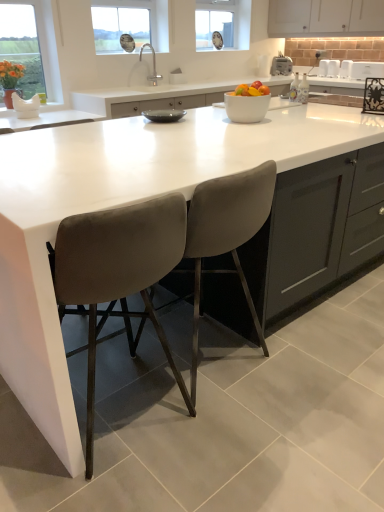
Find the location of a particular element. clear glass window at upper center is located at coordinates (120, 27).

Where is `white plastic toaster at upper center, which appears as the third appliance when viewed from the front`? Image resolution: width=384 pixels, height=512 pixels. white plastic toaster at upper center, which appears as the third appliance when viewed from the front is located at coordinates (281, 65).

Identify the location of clear glass clock at upper center, placed as the 2th window screen when sorted from left to right. The image size is (384, 512). (216, 23).

This screenshot has height=512, width=384. What do you see at coordinates (226, 233) in the screenshot?
I see `velvet grey chair at center, which is the 2th chair in left-to-right order` at bounding box center [226, 233].

The height and width of the screenshot is (512, 384). What do you see at coordinates (325, 18) in the screenshot?
I see `white matte cabinet at upper center` at bounding box center [325, 18].

The width and height of the screenshot is (384, 512). What are the coordinates of `white matte cabinet at upper center` in the screenshot? It's located at (325, 18).

Identify the location of chrome metallic faucet at upper center. (153, 65).

Is the surface of velvet grey chair at center, which is the 2th chair in left-to-right order, in direct contact with velvet grey bar stool at center, arranged as the second chair when viewed from the right?

velvet grey chair at center, which is the 2th chair in left-to-right order, is not next to velvet grey bar stool at center, arranged as the second chair when viewed from the right, and they're not touching.

Which point is more distant from viewer, (243, 228) or (160, 329)?

The point (160, 329) is more distant.

In the scene shown: How different are the orientations of velvet grey chair at center, which is the 2th chair in left-to-right order, and velvet grey bar stool at center, arranged as the second chair when viewed from the right, in degrees?

The facing directions of velvet grey chair at center, which is the 2th chair in left-to-right order, and velvet grey bar stool at center, arranged as the second chair when viewed from the right, are 8.98e-05 degrees apart.

Where is `chair behind the velvet grey bar stool at center, the 1th chair from the left`? chair behind the velvet grey bar stool at center, the 1th chair from the left is located at coordinates (226, 233).

Is chrome metallic faucet at upper center further to camera compared to white glossy microwave at upper right, the 1th appliance from the right?

No, chrome metallic faucet at upper center is closer to the camera.

Considering the points (141, 47) and (376, 66), which point is behind, point (141, 47) or point (376, 66)?

Point (376, 66)

Is chrome metallic faucet at upper center to the left of white glossy microwave at upper right, arranged as the 1th appliance when viewed from the front, from the viewer's perspective?

Yes, chrome metallic faucet at upper center is to the left of white glossy microwave at upper right, arranged as the 1th appliance when viewed from the front.

Are white glossy microwave at upper right, which is the third appliance in left-to-right order, and velvet grey bar stool at center, arranged as the second chair when viewed from the right, located far from each other?

white glossy microwave at upper right, which is the third appliance in left-to-right order, is far away from velvet grey bar stool at center, arranged as the second chair when viewed from the right.

Which object is wider, white glossy microwave at upper right, the 1th appliance from the right, or velvet grey bar stool at center, the 1th chair from the left?

velvet grey bar stool at center, the 1th chair from the left.

Does white glossy microwave at upper right, which is the third appliance in left-to-right order, have a lesser height compared to velvet grey bar stool at center, arranged as the second chair when viewed from the right?

Yes.

Which object is thinner, chrome metallic faucet at upper center or velvet grey bar stool at center, the 1th chair from the left?

chrome metallic faucet at upper center is thinner.

How many degrees apart are the facing directions of chrome metallic faucet at upper center and velvet grey bar stool at center, the 1th chair from the left?

The angle between the facing direction of chrome metallic faucet at upper center and the facing direction of velvet grey bar stool at center, the 1th chair from the left, is 176 degrees.

Looking at this image, is chrome metallic faucet at upper center at the right side of velvet grey bar stool at center, arranged as the second chair when viewed from the right?

In fact, chrome metallic faucet at upper center is to the left of velvet grey bar stool at center, arranged as the second chair when viewed from the right.

Measure the distance between chrome metallic faucet at upper center and velvet grey bar stool at center, the 1th chair from the left.

chrome metallic faucet at upper center and velvet grey bar stool at center, the 1th chair from the left, are 11.48 feet apart.

Is velvet grey chair at center, which is the 2th chair in left-to-right order, surrounding clear glass window at upper center?

No, clear glass window at upper center is not a part of velvet grey chair at center, which is the 2th chair in left-to-right order.

How many degrees apart are the facing directions of velvet grey chair at center, which is the 2th chair in left-to-right order, and clear glass window at upper center?

The angle between the facing direction of velvet grey chair at center, which is the 2th chair in left-to-right order, and the facing direction of clear glass window at upper center is 180 degrees.

Consider the image. Are velvet grey chair at center, placed as the first chair when sorted from right to left, and clear glass window at upper center far apart?

Yes.

Considering the sizes of objects velvet grey chair at center, which is the 2th chair in left-to-right order, and clear glass window at upper center in the image provided, who is taller, velvet grey chair at center, which is the 2th chair in left-to-right order, or clear glass window at upper center?

velvet grey chair at center, which is the 2th chair in left-to-right order.

In the image, is velvet grey bar stool at center, the 1th chair from the left, on the left side or the right side of white glossy microwave at upper right, which is the third appliance in left-to-right order?

Clearly, velvet grey bar stool at center, the 1th chair from the left, is on the left of white glossy microwave at upper right, which is the third appliance in left-to-right order, in the image.

Does velvet grey bar stool at center, the 1th chair from the left, come in front of white glossy microwave at upper right, the 1th appliance from the right?

Yes, it is.

From the image's perspective, is velvet grey bar stool at center, arranged as the second chair when viewed from the right, positioned above or below white glossy microwave at upper right, arranged as the 1th appliance when viewed from the front?

Clearly, from the image's perspective, velvet grey bar stool at center, arranged as the second chair when viewed from the right, is below white glossy microwave at upper right, arranged as the 1th appliance when viewed from the front.

Could you tell me if white plastic toaster at upper right, acting as the 2th appliance starting from the right, is turned towards clear glass clock at upper center, marked as the first window screen in a right-to-left arrangement?

No, white plastic toaster at upper right, acting as the 2th appliance starting from the right, is not turned towards clear glass clock at upper center, marked as the first window screen in a right-to-left arrangement.

Can you confirm if white plastic toaster at upper right, which appears as the second appliance when viewed from the back, is positioned to the left of clear glass clock at upper center, placed as the 2th window screen when sorted from left to right?

No.

Can you confirm if white plastic toaster at upper right, which appears as the second appliance when viewed from the back, is taller than clear glass clock at upper center, the 1th window screen when ordered from back to front?

No.

This screenshot has height=512, width=384. I want to click on chair on the right of velvet grey bar stool at center, arranged as the second chair when viewed from the right, so click(x=226, y=233).

In order to click on tap located in front of the white glossy microwave at upper right, which is the third appliance in left-to-right order in this screenshot , I will do `click(153, 65)`.

Estimate the real-world distances between objects in this image. Which object is closer to clear glass window at upper center, velvet grey chair at center, placed as the first chair when sorted from right to left, or white plastic toaster at upper center, arranged as the 1th appliance when viewed from the left?

white plastic toaster at upper center, arranged as the 1th appliance when viewed from the left, is closer to clear glass window at upper center.

From the image, which object appears to be farther from chrome metallic faucet at upper center, white glossy microwave at upper right, arranged as the 1th appliance when viewed from the front, or clear glass clock at upper center, placed as the 2th window screen when sorted from left to right?

white glossy microwave at upper right, arranged as the 1th appliance when viewed from the front.

Based on their spatial positions, is chrome metallic faucet at upper center or white plastic toaster at upper center, which appears as the third appliance when viewed from the front, closer to white matte cabinet at upper center?

The object closer to white matte cabinet at upper center is white plastic toaster at upper center, which appears as the third appliance when viewed from the front.

In the scene shown: Considering their positions, is chrome metallic faucet at upper center positioned closer to velvet grey bar stool at center, the 1th chair from the left, than clear glass clock at upper center, the 1th window screen when ordered from back to front?

Based on the image, chrome metallic faucet at upper center appears to be nearer to velvet grey bar stool at center, the 1th chair from the left.

Looking at the image, which one is located closer to clear glass window at upper center, white matte cabinet at upper center or chrome metallic faucet at upper center?

The object closer to clear glass window at upper center is chrome metallic faucet at upper center.

Which object lies nearer to the anchor point white plastic toaster at upper center, positioned as the third appliance in right-to-left order, chrome metallic faucet at upper center or clear glass clock at upper center, which is the 2th window screen in front-to-back order?

clear glass clock at upper center, which is the 2th window screen in front-to-back order.

Looking at the image, which one is located closer to velvet grey bar stool at center, the 1th chair from the left, matte glass window at upper left, which ranks as the 1th window screen in bottom-to-top order, or clear glass clock at upper center, placed as the 2th window screen when sorted from left to right?

matte glass window at upper left, which ranks as the 1th window screen in bottom-to-top order, lies closer to velvet grey bar stool at center, the 1th chair from the left, than the other object.

Looking at the image, which one is located closer to velvet grey chair at center, placed as the first chair when sorted from right to left, white plastic toaster at upper right, which appears as the second appliance when viewed from the left, or matte glass window at upper left, marked as the first window screen in a front-to-back arrangement?

Among the two, matte glass window at upper left, marked as the first window screen in a front-to-back arrangement, is located nearer to velvet grey chair at center, placed as the first chair when sorted from right to left.

Where is `window screen between clear glass window at upper center and white matte cabinet at upper center from left to right`? This screenshot has height=512, width=384. window screen between clear glass window at upper center and white matte cabinet at upper center from left to right is located at coordinates 216,23.

This screenshot has width=384, height=512. Identify the location of tap between clear glass window at upper center and white plastic toaster at upper right, which appears as the second appliance when viewed from the left, in the horizontal direction. (153, 65).

Locate an element on the screen. Image resolution: width=384 pixels, height=512 pixels. tap between matte glass window at upper left, the second window screen from the top, and white matte cabinet at upper center is located at coordinates (153, 65).

The width and height of the screenshot is (384, 512). In order to click on tap positioned between velvet grey bar stool at center, arranged as the second chair when viewed from the right, and white plastic toaster at upper center, which appears as the third appliance when viewed from the front, from near to far in this screenshot , I will do `click(153, 65)`.